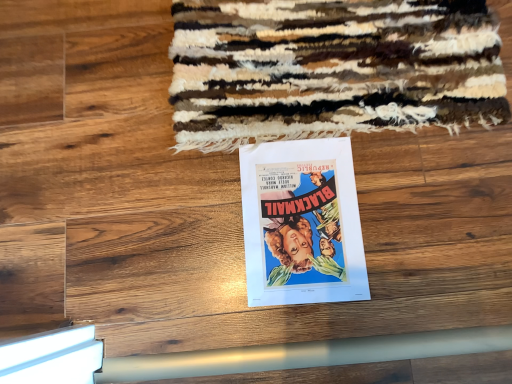
Find the location of a particular element. The height and width of the screenshot is (384, 512). matte paper poster at center is located at coordinates (302, 223).

Describe the element at coordinates (302, 223) in the screenshot. This screenshot has height=384, width=512. I see `matte paper poster at center` at that location.

What is the approximate height of matte paper poster at center?

It is 0.78 inches.

The image size is (512, 384). I want to click on matte paper poster at center, so click(302, 223).